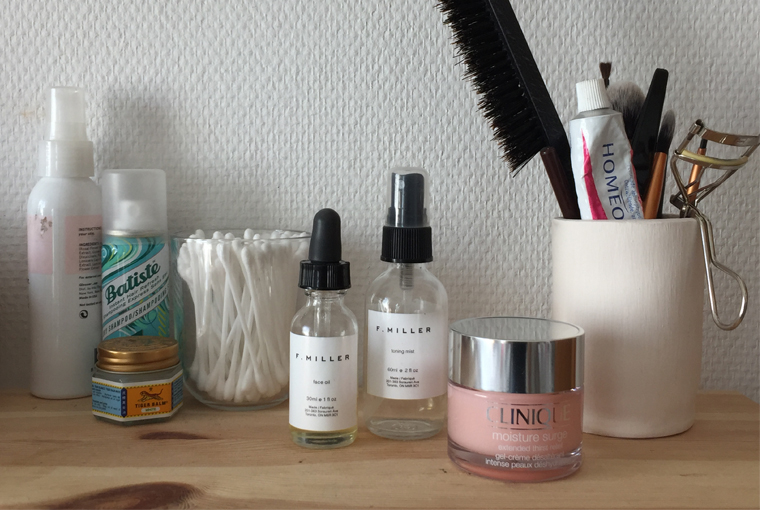
Find the location of a particular element. white textured wallpaper is located at coordinates (201, 124).